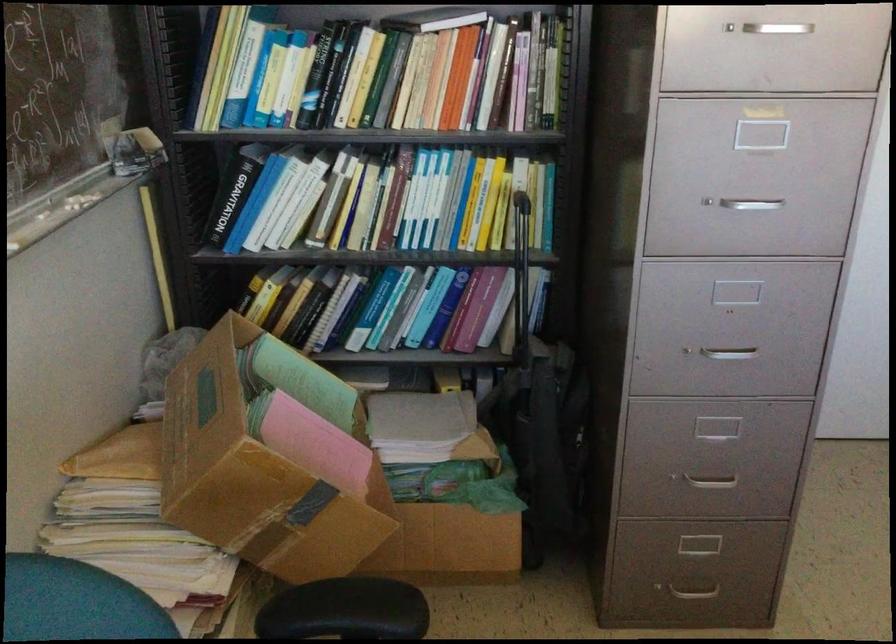
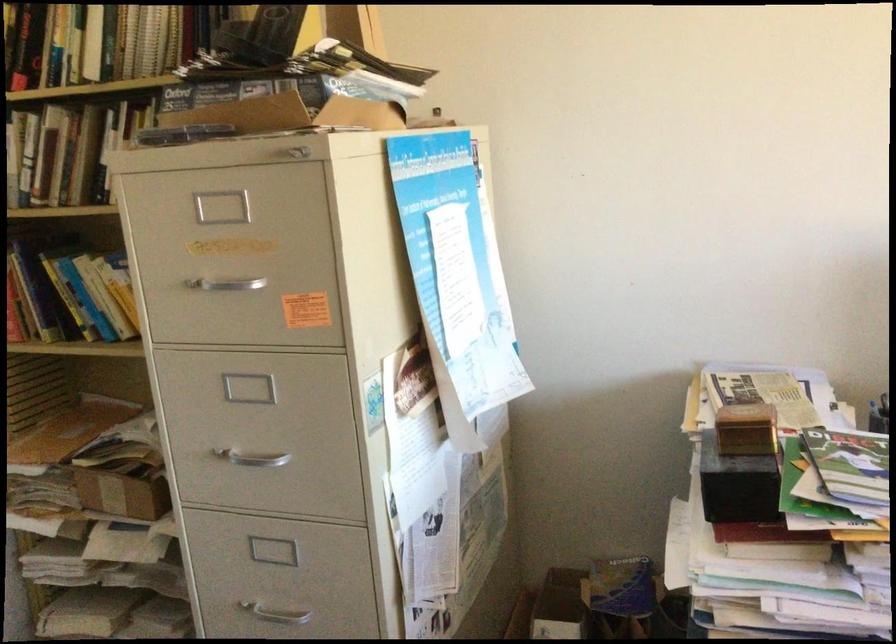
Question: Based on the continuous images, in which direction is the camera rotating? Reply with the corresponding letter.

Choices:
 (A) Left
 (B) Right
 (C) Up
 (D) Down

Answer: (B)